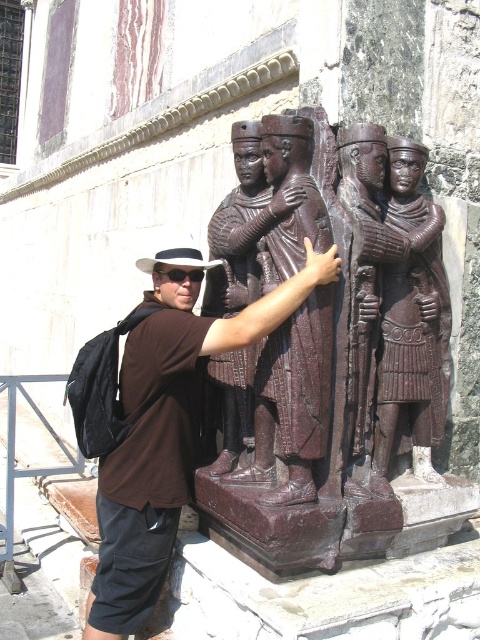
Which is behind, point (296, 141) or point (149, 404)?

Point (149, 404)

Is brown marble statue at center smaller than brown matte shirt at center?

Correct, brown marble statue at center occupies less space than brown matte shirt at center.

What do you see at coordinates (342, 355) in the screenshot?
I see `brown marble statue at center` at bounding box center [342, 355].

This screenshot has height=640, width=480. What are the coordinates of `brown marble statue at center` in the screenshot? It's located at (342, 355).

Who is shorter, brown matte shirt at center or brown polished wood statue at center?

brown polished wood statue at center

Describe the element at coordinates (168, 429) in the screenshot. I see `brown matte shirt at center` at that location.

The height and width of the screenshot is (640, 480). I want to click on brown matte shirt at center, so click(x=168, y=429).

Is brown polished wood statue at center thinner than black plastic goggles at upper center?

A: Correct, brown polished wood statue at center's width is less than black plastic goggles at upper center's.

Does brown polished wood statue at center have a larger size compared to black plastic goggles at upper center?

No.

Which is in front, point (420, 259) or point (186, 275)?

Point (420, 259)

In order to click on brown polished wood statue at center in this screenshot , I will do `click(411, 324)`.